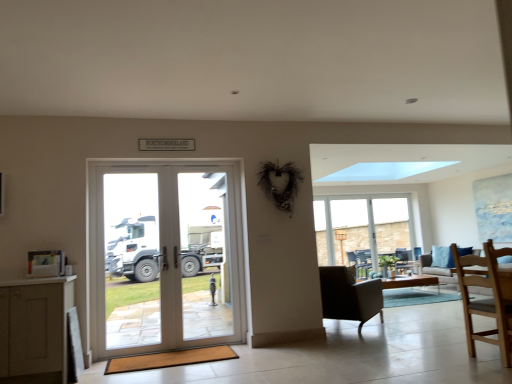
Where is `clear glass window at center`? The height and width of the screenshot is (384, 512). clear glass window at center is located at coordinates point(361,226).

This screenshot has width=512, height=384. What do you see at coordinates (361, 226) in the screenshot?
I see `clear glass window at center` at bounding box center [361, 226].

At what (x,y) coordinates should I click in order to perform the action: click on light brown wooden chair at lower right, acting as the first chair starting from the right. Please return your answer as a coordinate pair (x, y). Looking at the image, I should click on (486, 299).

How much space does light brown wooden chair at lower right, which is the 2th chair in back-to-front order, occupy vertically?

The height of light brown wooden chair at lower right, which is the 2th chair in back-to-front order, is 1.00 meters.

The width and height of the screenshot is (512, 384). What are the coordinates of `clear glass door at center` in the screenshot? It's located at (205, 255).

Describe the element at coordinates (205, 255) in the screenshot. I see `clear glass door at center` at that location.

Where is `white glass door at center`? This screenshot has height=384, width=512. white glass door at center is located at coordinates (165, 257).

Describe the element at coordinates (410, 281) in the screenshot. I see `wooden table at center` at that location.

The image size is (512, 384). I want to click on wooden table at center, so click(x=410, y=281).

This screenshot has width=512, height=384. I want to click on clear glass window at center, so click(361, 226).

From the picture: Is clear glass window at center spatially inside green matte vase at center, or outside of it?

clear glass window at center exists outside the volume of green matte vase at center.

From a real-world perspective, does clear glass window at center stand above green matte vase at center?

Yes.

From the image's perspective, does clear glass window at center appear lower than green matte vase at center?

No, from the image's perspective, clear glass window at center is not below green matte vase at center.

Considering the positions of objects dark brown leather armchair at right and light gray fabric couch at right in the image provided, who is more to the left, dark brown leather armchair at right or light gray fabric couch at right?

From the viewer's perspective, dark brown leather armchair at right appears more on the left side.

From a real-world perspective, is dark brown leather armchair at right located beneath light gray fabric couch at right?

No.

Considering their positions, is dark brown leather armchair at right located in front of or behind light gray fabric couch at right?

dark brown leather armchair at right is positioned farther from the viewer than light gray fabric couch at right.

Does point (417, 251) lie in front of point (457, 284)?

No, (417, 251) is further to viewer.

Which is more to the left, light gray fabric couch at right or clear glass door at center?

clear glass door at center is more to the left.

In the scene shown: Which of these two, light gray fabric couch at right or clear glass door at center, is thinner?

clear glass door at center.

Which is closer to the camera, (498,267) or (208,232)?

The point (498,267) is more forward.

How many degrees apart are the facing directions of light gray fabric couch at right and clear glass door at center?

light gray fabric couch at right and clear glass door at center are facing 91.1 degrees away from each other.

Looking at this image, from the image's perspective, is light gray fabric couch at right located above or below light brown wooden chair at lower right, which is the 2th chair in back-to-front order?

Clearly, from the image's perspective, light gray fabric couch at right is below light brown wooden chair at lower right, which is the 2th chair in back-to-front order.

Could light brown wooden chair at lower right, which is the 2th chair in back-to-front order, be considered to be inside light gray fabric couch at right?

That's incorrect, light brown wooden chair at lower right, which is the 2th chair in back-to-front order, is not inside light gray fabric couch at right.

Is light gray fabric couch at right turned away from light brown wooden chair at lower right, acting as the first chair starting from the right?

No, light brown wooden chair at lower right, acting as the first chair starting from the right, is not at the back of light gray fabric couch at right.

Based on the photo, which object is wider, light gray fabric couch at right or light brown wooden chair at lower right, which is the 1th chair in front-to-back order?

Wider between the two is light gray fabric couch at right.

From a real-world perspective, which is physically below, light brown wooden chair at lower right, acting as the first chair starting from the right, or clear glass window at center?

From a 3D spatial view, light brown wooden chair at lower right, acting as the first chair starting from the right, is below.

From the image's perspective, is light brown wooden chair at lower right, which is the 1th chair in front-to-back order, on clear glass window at center?

Yes, from the image's perspective, light brown wooden chair at lower right, which is the 1th chair in front-to-back order, is on top of clear glass window at center.

Is light brown wooden chair at lower right, acting as the first chair starting from the right, wider or thinner than clear glass window at center?

Clearly, light brown wooden chair at lower right, acting as the first chair starting from the right, has more width compared to clear glass window at center.

Is dark brown leather armchair at lower right, the first chair viewed from the back, with clear glass door at center?

dark brown leather armchair at lower right, the first chair viewed from the back, and clear glass door at center are clearly separated.

Based on the photo, does dark brown leather armchair at lower right, acting as the second chair starting from the right, have a smaller size compared to clear glass door at center?

Actually, dark brown leather armchair at lower right, acting as the second chair starting from the right, might be larger than clear glass door at center.

Looking at this image, how different are the orientations of dark brown leather armchair at lower right, the first chair viewed from the back, and clear glass door at center in degrees?

The angle between the facing direction of dark brown leather armchair at lower right, the first chair viewed from the back, and the facing direction of clear glass door at center is 126 degrees.

Can you confirm if dark brown leather armchair at lower right, acting as the second chair starting from the right, is wider than clear glass door at center?

Indeed, dark brown leather armchair at lower right, acting as the second chair starting from the right, has a greater width compared to clear glass door at center.

Between dark brown leather armchair at lower right, the 1th chair when ordered from left to right, and dark brown leather armchair at right, which one has larger width?

dark brown leather armchair at lower right, the 1th chair when ordered from left to right, is wider.

Is dark brown leather armchair at lower right, the 1th chair when ordered from left to right, in front of or behind dark brown leather armchair at right in the image?

In the image, dark brown leather armchair at lower right, the 1th chair when ordered from left to right, appears in front of dark brown leather armchair at right.

Is dark brown leather armchair at lower right, acting as the second chair starting from the right, touching dark brown leather armchair at right?

dark brown leather armchair at lower right, acting as the second chair starting from the right, and dark brown leather armchair at right are clearly separated.

Where is `window behind the green matte vase at center`? window behind the green matte vase at center is located at coordinates (361, 226).

Locate an element on the screen. This screenshot has height=384, width=512. studio couch to the right of dark brown leather armchair at right is located at coordinates (440, 273).

From the image, which object appears to be nearer to dark brown leather armchair at lower right, the first chair viewed from the back, light brown wooden chair at lower right, which is the 2th chair in back-to-front order, or clear glass door at center?

light brown wooden chair at lower right, which is the 2th chair in back-to-front order, is closer to dark brown leather armchair at lower right, the first chair viewed from the back.

When comparing their distances from dark brown leather armchair at right, does light brown wooden chair at lower right, acting as the first chair starting from the right, or light gray fabric couch at right seem closer?

Among the two, light gray fabric couch at right is located nearer to dark brown leather armchair at right.

From the image, which object appears to be nearer to wooden table at center, clear glass window at center or light gray fabric couch at right?

Based on the image, light gray fabric couch at right appears to be nearer to wooden table at center.

Considering their positions, is clear glass door at center positioned closer to light gray fabric couch at right than light brown wooden chair at lower right, which is the 2th chair in back-to-front order?

light brown wooden chair at lower right, which is the 2th chair in back-to-front order, is positioned closer to the anchor light gray fabric couch at right.

From the image, which object appears to be nearer to green matte vase at center, dark brown leather armchair at lower right, the first chair viewed from the back, or clear glass door at center?

Among the two, dark brown leather armchair at lower right, the first chair viewed from the back, is located nearer to green matte vase at center.

Estimate the real-world distances between objects in this image. Which object is closer to clear glass door at center, dark brown leather armchair at right or light gray fabric couch at right?

Based on the image, light gray fabric couch at right appears to be nearer to clear glass door at center.

When comparing their distances from light brown wooden chair at lower right, acting as the first chair starting from the right, does wooden table at center or white glass door at center seem further?

Among the two, wooden table at center is located further to light brown wooden chair at lower right, acting as the first chair starting from the right.

When comparing their distances from light gray fabric couch at right, does blue fabric pillow at right or clear glass window at center seem further?

clear glass window at center is positioned further to the anchor light gray fabric couch at right.

In order to click on window positioned between dark brown leather armchair at lower right, which is the second chair in front-to-back order, and dark brown leather armchair at right from near to far in this screenshot , I will do `click(361, 226)`.

Where is `door between light brown wooden chair at lower right, which is the 1th chair in front-to-back order, and wooden table at center, along the z-axis`? The image size is (512, 384). door between light brown wooden chair at lower right, which is the 1th chair in front-to-back order, and wooden table at center, along the z-axis is located at coordinates (165, 257).

This screenshot has height=384, width=512. Identify the location of chair between light brown wooden chair at lower right, which is the 2th chair in left-to-right order, and blue fabric pillow at right from front to back. (349, 295).

What are the coordinates of `armchair between white glass door at center and blue fabric pillow at right from left to right` in the screenshot? It's located at (417, 252).